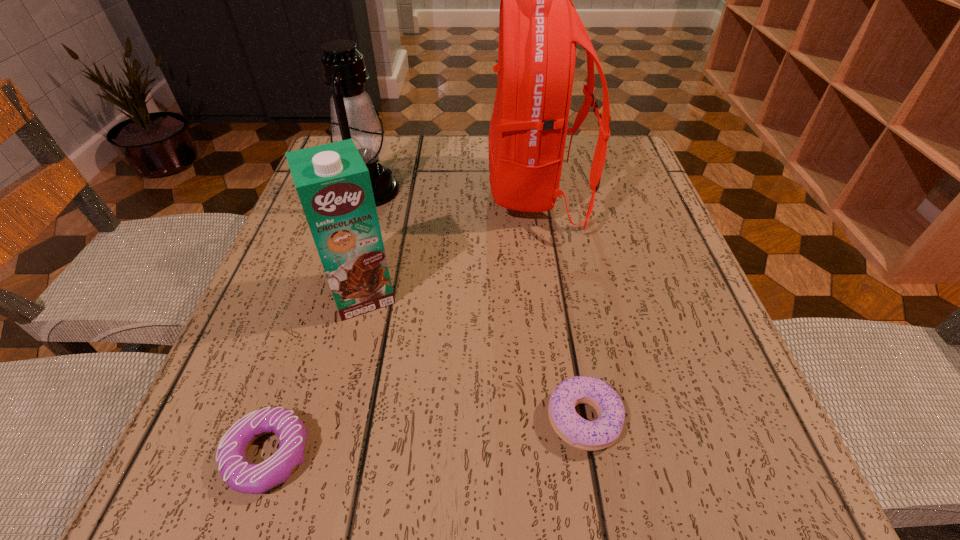
Identify the location of empty space that is in between the right doughnut and the oil lamp. The width and height of the screenshot is (960, 540). (476, 305).

Image resolution: width=960 pixels, height=540 pixels. Find the location of `free spot between the third farthest object and the tallest object`. free spot between the third farthest object and the tallest object is located at coordinates (449, 242).

The height and width of the screenshot is (540, 960). Find the location of `free space between the left doughnut and the backpack`. free space between the left doughnut and the backpack is located at coordinates (402, 323).

The width and height of the screenshot is (960, 540). I want to click on free space between the left doughnut and the carton, so click(316, 374).

The width and height of the screenshot is (960, 540). What are the coordinates of `vacant region between the left doughnut and the carton` in the screenshot? It's located at point(316,374).

Point out which object is positioned as the second nearest to the right doughnut. Please provide its 2D coordinates. Your answer should be formatted as a tuple, i.e. [(x, y)], where the tuple contains the x and y coordinates of a point satisfying the conditions above.

[(539, 26)]

Choose which object is the second nearest neighbor to the left doughnut. Please provide its 2D coordinates. Your answer should be formatted as a tuple, i.e. [(x, y)], where the tuple contains the x and y coordinates of a point satisfying the conditions above.

[(599, 434)]

Where is `free space that satisfies the following two spatial constraints: 1. on the front side of the third nearest object; 2. on the left side of the right doughnut`? The height and width of the screenshot is (540, 960). free space that satisfies the following two spatial constraints: 1. on the front side of the third nearest object; 2. on the left side of the right doughnut is located at coordinates (331, 419).

Identify the location of free location that satisfies the following two spatial constraints: 1. on the main compartment of the right doughnut; 2. on the right side of the backpack. The image size is (960, 540). (570, 419).

At what (x,y) coordinates should I click in order to perform the action: click on vacant space that satisfies the following two spatial constraints: 1. on the main compartment of the backpack; 2. on the front side of the left doughnut. Please return your answer as a coordinate pair (x, y). This screenshot has height=540, width=960. Looking at the image, I should click on (576, 455).